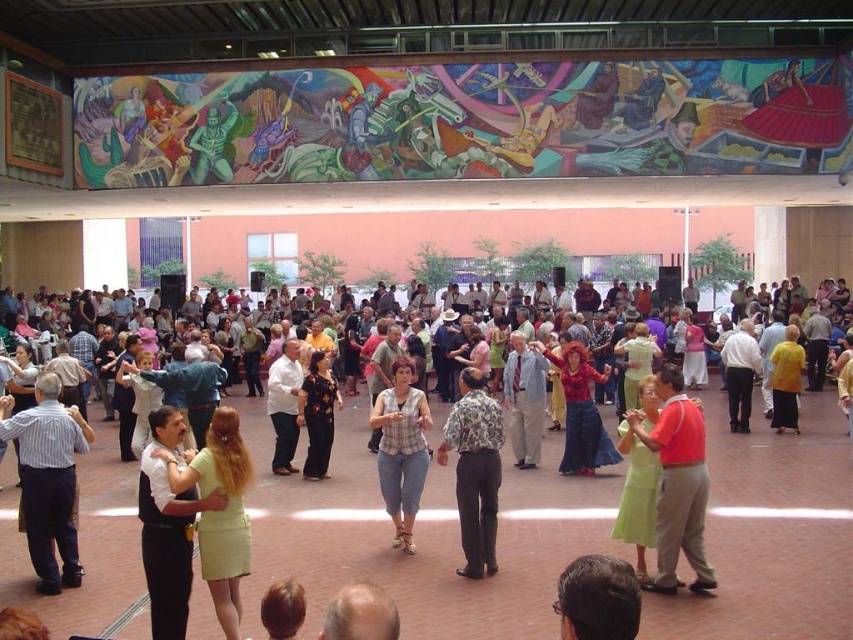
Is floral shirt at center below light brown hair at lower center?

Yes.

Looking at this image, does floral shirt at center appear on the right side of light brown hair at lower center?

No, floral shirt at center is not to the right of light brown hair at lower center.

Which is behind, point (476, 513) or point (637, 624)?

Point (476, 513)

At what (x,y) coordinates should I click in order to perform the action: click on floral shirt at center. Please return your answer as a coordinate pair (x, y). This screenshot has width=853, height=640. Looking at the image, I should click on (474, 468).

Is plaid shirt at center smaller than white cotton shirt at center?

No, plaid shirt at center is not smaller than white cotton shirt at center.

What do you see at coordinates (401, 449) in the screenshot?
I see `plaid shirt at center` at bounding box center [401, 449].

Is point (409, 499) farther from viewer compared to point (288, 472)?

No.

This screenshot has width=853, height=640. What are the coordinates of `plaid shirt at center` in the screenshot? It's located at (401, 449).

Is floral dress at center thinner than striped cotton shirt at lower left?

Incorrect, floral dress at center's width is not less than striped cotton shirt at lower left's.

Can you confirm if floral dress at center is smaller than striped cotton shirt at lower left?

No.

Who is more forward, [802,440] or [78,452]?

Point [78,452] is in front.

This screenshot has height=640, width=853. Find the location of `floral dress at center`. floral dress at center is located at coordinates (422, 536).